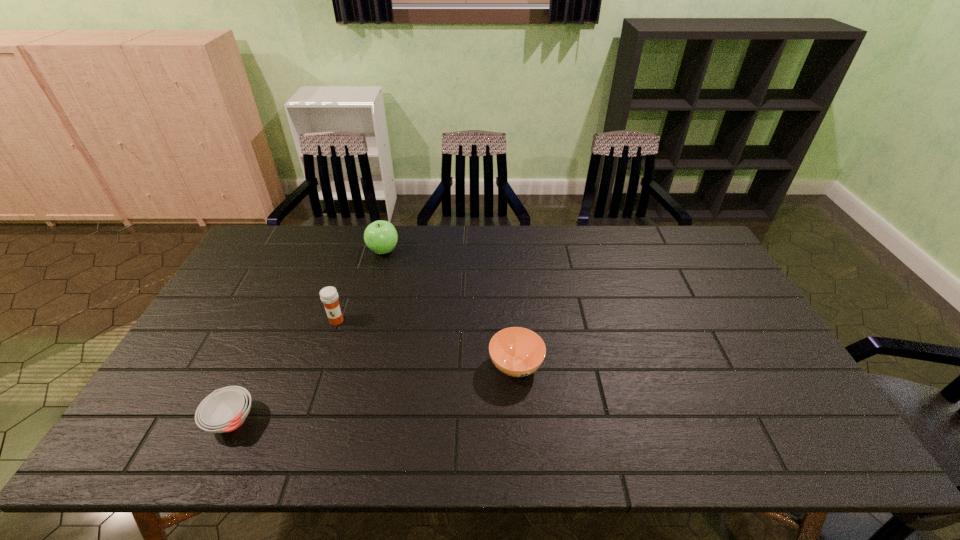
Choose which object is the third nearest neighbor to the third object from right to left. Please provide its 2D coordinates. Your answer should be formatted as a tuple, i.e. [(x, y)], where the tuple contains the x and y coordinates of a point satisfying the conditions above.

[(517, 352)]

Find the location of `vacant area that satisfies the following two spatial constraints: 1. on the back side of the shortest object; 2. on the right side of the second object from right to left`. vacant area that satisfies the following two spatial constraints: 1. on the back side of the shortest object; 2. on the right side of the second object from right to left is located at coordinates (311, 251).

Locate an element on the screen. free spot that satisfies the following two spatial constraints: 1. on the back side of the nearest object; 2. on the right side of the apple is located at coordinates (311, 251).

You are a GUI agent. You are given a task and a screenshot of the screen. Output one action in this format:
    pyautogui.click(x=<x>, y=<y>)
    Task: Click on the free location that satisfies the following two spatial constraints: 1. on the label side of the second nearest object; 2. on the left side of the second object from left to right
    Image resolution: width=960 pixels, height=540 pixels.
    Given the screenshot: What is the action you would take?
    pyautogui.click(x=322, y=366)

Find the location of a particular element. Image resolution: width=960 pixels, height=540 pixels. vacant space that satisfies the following two spatial constraints: 1. on the back side of the shortest object; 2. on the left side of the farthest object is located at coordinates (311, 251).